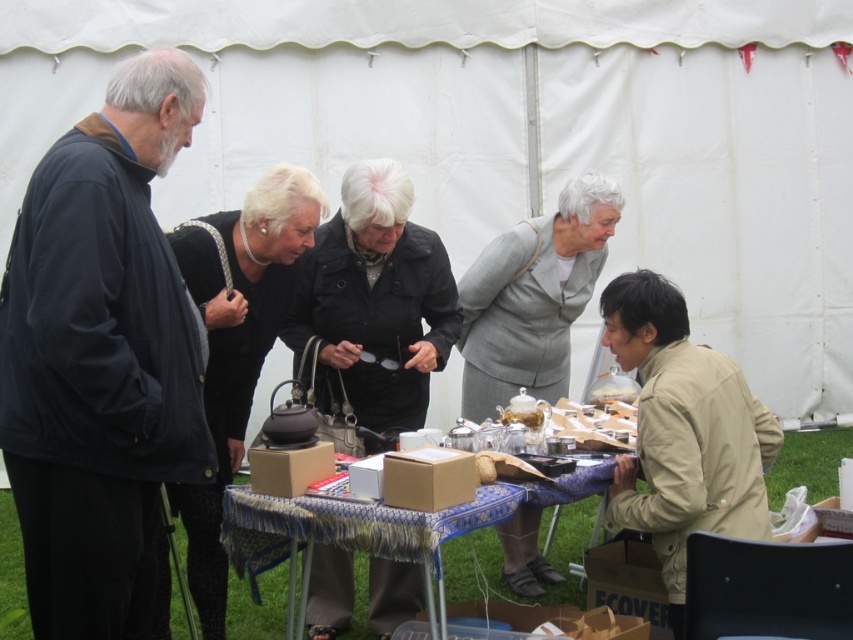
You are standing at the back of the tent and want to approach the gray fabric suit at center without walking behind the black fabric jacket at left. Is this possible?

The black fabric jacket at left is in front of the gray fabric suit at center, so you cannot approach the gray fabric suit at center without passing behind the black fabric jacket at left.

You are a delivery person who needs to place a package on the blue fabric table at center. The package is 36 inches long. Can you slide the black leather jacket at center to make space? Explain why or why not based on their current distance.

The black leather jacket at center and blue fabric table at center are 35.40 inches apart. Since the package is 36 inches long, which is slightly longer than the distance between them, sliding the black leather jacket at center might not provide enough space. The distance is insufficient to accommodate the package.

You are a photographer standing at the edge of the scene. You need to capture a photo where the black leather jacket at center is visible above the blue fabric table at center. Based on the scene description, is this possible?

Yes, the black leather jacket at center is positioned above the blue fabric table at center, so capturing it in that manner is possible.